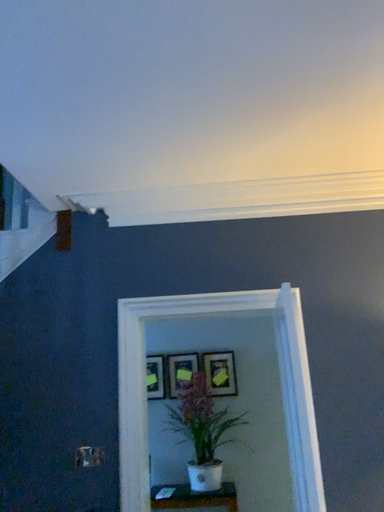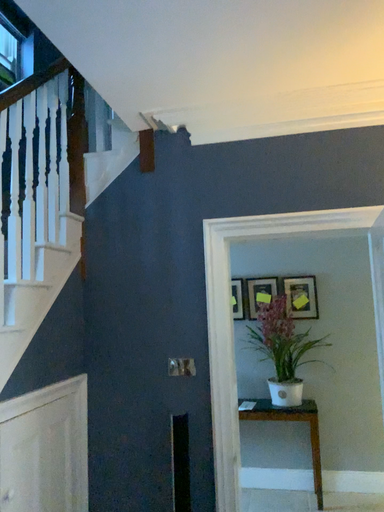
Question: How did the camera likely rotate when shooting the video?

Choices:
 (A) rotated left
 (B) rotated right

Answer: (A)